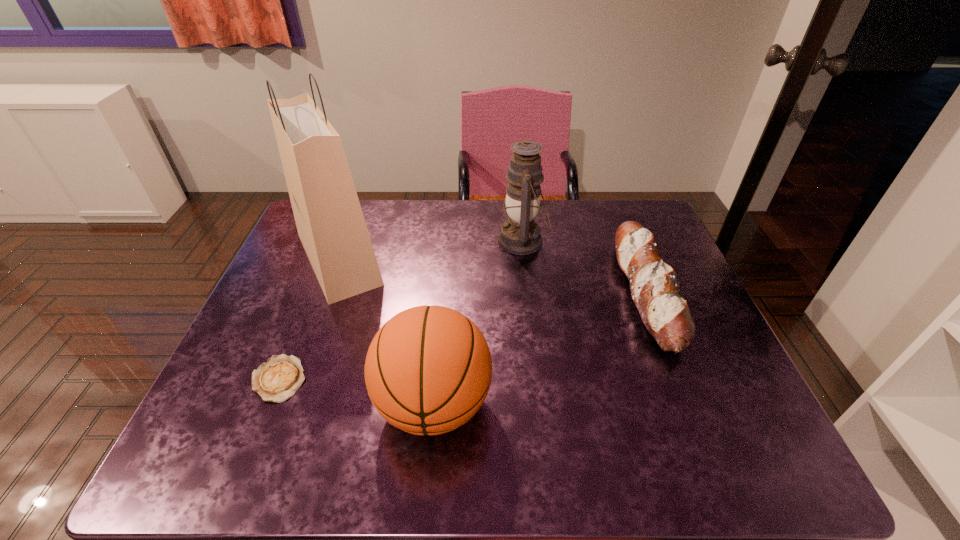
At what (x,y) coordinates should I click in order to perform the action: click on the tallest object. Please return your answer as a coordinate pair (x, y). This screenshot has width=960, height=540. Looking at the image, I should click on (330, 223).

Identify the location of the second tallest object. Image resolution: width=960 pixels, height=540 pixels. tap(520, 234).

You are a GUI agent. You are given a task and a screenshot of the screen. Output one action in this format:
    pyautogui.click(x=<x>, y=<y>)
    Task: Click on the oil lamp
    The height and width of the screenshot is (540, 960).
    Given the screenshot: What is the action you would take?
    pyautogui.click(x=520, y=234)

Identify the location of basketball. (428, 370).

Identify the location of the third shortest object. (428, 370).

Where is `baguet`? The width and height of the screenshot is (960, 540). baguet is located at coordinates (654, 289).

This screenshot has height=540, width=960. Identify the location of the rightmost object. (654, 289).

Image resolution: width=960 pixels, height=540 pixels. I want to click on quiche, so click(x=277, y=380).

Locate an element on the screen. This screenshot has width=960, height=540. free space located 0.100m on the back of the tallest object is located at coordinates (359, 204).

Identify the location of free space located on the right of the second tallest object. This screenshot has width=960, height=540. (621, 241).